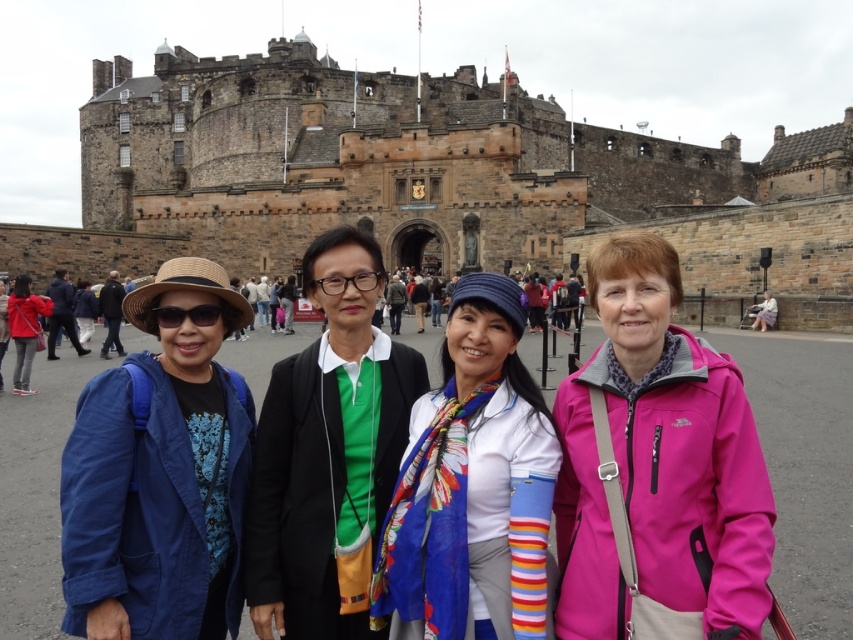
Question: Can you confirm if brown stone castle at center is positioned above pink softshell jacket at right?

Choices:
 (A) yes
 (B) no

Answer: (A)

Question: Which of the following is the closest to the observer?

Choices:
 (A) (254, 509)
 (B) (184, 308)
 (C) (549, 476)

Answer: (C)

Question: Considering the relative positions of pink softshell jacket at right and white matte scarf at center in the image provided, where is pink softshell jacket at right located with respect to white matte scarf at center?

Choices:
 (A) above
 (B) below

Answer: (A)

Question: Which point is closer to the camera?

Choices:
 (A) (165, 314)
 (B) (473, 467)
 (C) (335, 632)
 (D) (669, 372)

Answer: (C)

Question: Is matte blue jacket at lower left to the left of white matte scarf at center from the viewer's perspective?

Choices:
 (A) no
 (B) yes

Answer: (B)

Question: Which point is closer to the camera?

Choices:
 (A) brown stone castle at center
 (B) pink softshell jacket at right
 (C) white matte scarf at center
 (D) green matte shirt at center

Answer: (B)